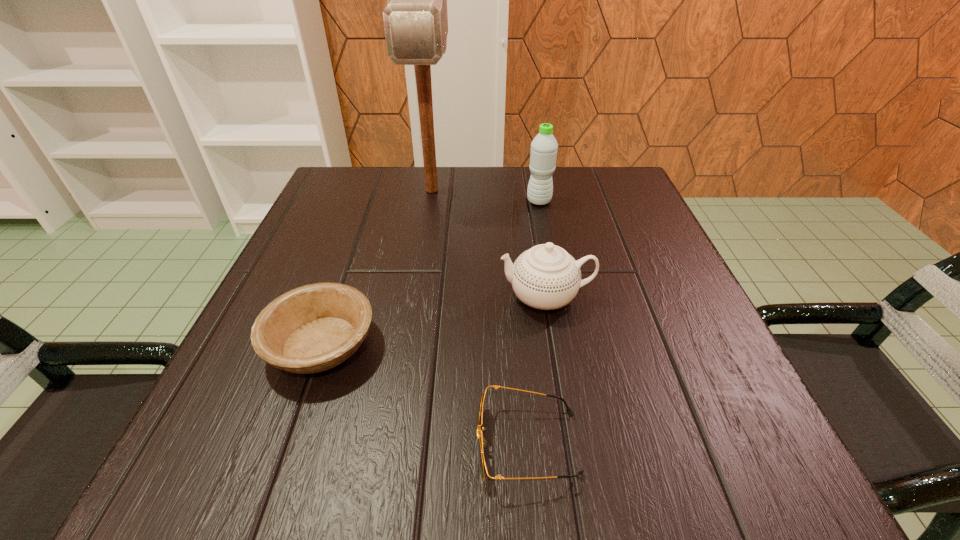
You are a GUI agent. You are given a task and a screenshot of the screen. Output one action in this format:
    pyautogui.click(x=<x>, y=<y>)
    Task: Click on the object that is at the left edge
    The height and width of the screenshot is (540, 960).
    Given the screenshot: What is the action you would take?
    pyautogui.click(x=313, y=328)

In the image, there is a desktop. Where is `free space at the far edge`? free space at the far edge is located at coordinates (410, 208).

Locate an element on the screen. vacant space at the near edge of the desktop is located at coordinates (630, 462).

Where is `free space at the left edge of the desktop`? This screenshot has width=960, height=540. free space at the left edge of the desktop is located at coordinates (301, 226).

Find the location of a particular element. The image size is (960, 540). free space at the right edge of the desktop is located at coordinates (719, 339).

The width and height of the screenshot is (960, 540). What are the coordinates of `vacant space at the far left corner` in the screenshot? It's located at (315, 219).

Locate an element on the screen. vacant region at the far right corner of the desktop is located at coordinates (623, 184).

You are a GUI agent. You are given a task and a screenshot of the screen. Output one action in this format:
    pyautogui.click(x=<x>, y=<y>)
    Task: Click on the empty location between the bowl and the third tallest object
    The image size is (960, 540).
    Given the screenshot: What is the action you would take?
    pyautogui.click(x=434, y=321)

The width and height of the screenshot is (960, 540). Find the location of `vacant area between the water bottle and the tallest object`. vacant area between the water bottle and the tallest object is located at coordinates (486, 195).

At what (x,y) coordinates should I click in order to perform the action: click on vacant space that is in between the tallest object and the shortest object. Please return your answer as a coordinate pair (x, y). This screenshot has height=540, width=960. Looking at the image, I should click on (480, 317).